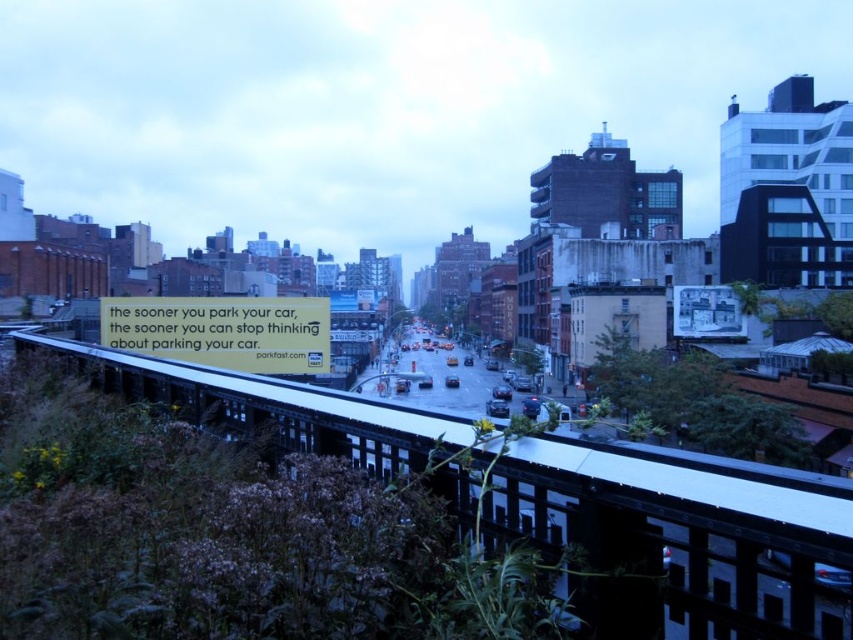
Question: Which object appears closest to the camera in this image?

Choices:
 (A) yellow paper sign at center
 (B) black metal train track at center

Answer: (B)

Question: Does black metal train track at center lie in front of yellow paper sign at center?

Choices:
 (A) yes
 (B) no

Answer: (A)

Question: Does black metal train track at center have a smaller size compared to yellow paper sign at center?

Choices:
 (A) no
 (B) yes

Answer: (A)

Question: Can you confirm if black metal train track at center is positioned to the right of yellow paper sign at center?

Choices:
 (A) yes
 (B) no

Answer: (A)

Question: Which point is farther to the camera?

Choices:
 (A) black metal train track at center
 (B) yellow paper sign at center

Answer: (B)